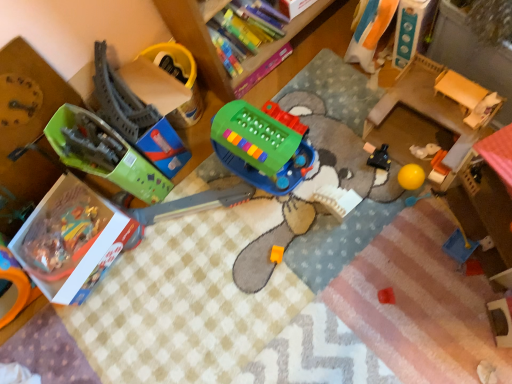
Identify the location of free location in front of black plastic toy at center-right, the second toy when ordered from right to left. (406, 214).